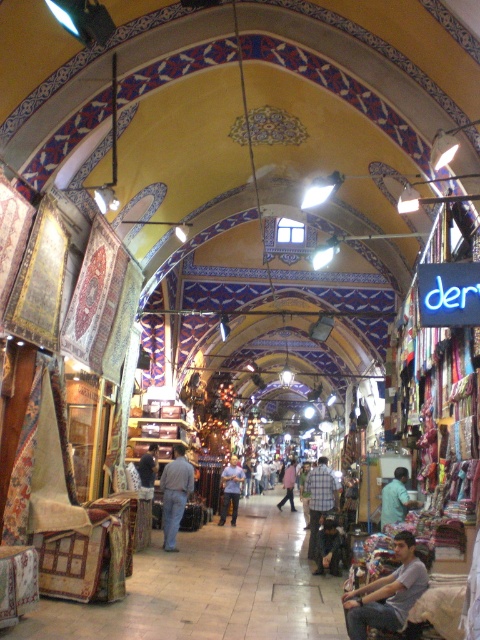
Question: Can you confirm if dark brown leather jacket at center is positioned to the left of light blue shirt at center?

Choices:
 (A) no
 (B) yes

Answer: (A)

Question: Among these points, which one is nearest to the camera?

Choices:
 (A) (168, 492)
 (B) (339, 564)
 (C) (398, 582)

Answer: (C)

Question: Which is farther from the plaid shirt at center?

Choices:
 (A) light pink fabric at center
 (B) light blue fabric at center

Answer: (A)

Question: Does blue jeans at center have a greater width compared to light pink fabric at center?

Choices:
 (A) no
 (B) yes

Answer: (A)

Question: Among these objects, which one is nearest to the camera?

Choices:
 (A) light pink fabric at center
 (B) plaid shirt at center

Answer: (B)

Question: Is light blue fabric at center thinner than dark gray fabric at center?

Choices:
 (A) no
 (B) yes

Answer: (B)